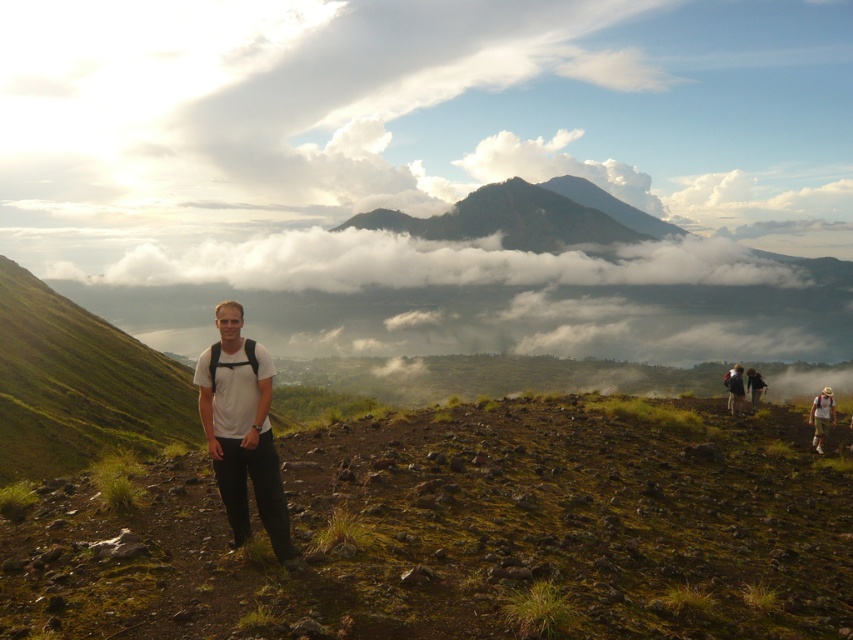
Is white matte t-shirt at center wider than light brown backpack at lower right?

No.

Measure the distance between point (227,337) and camera.

8.39 meters

Identify the location of white matte t-shirt at center. (241, 428).

In the scene shown: Does camouflage fabric backpack at lower right have a lesser height compared to dark brown backpack at right?

No.

Is camouflage fabric backpack at lower right further to the viewer compared to dark brown backpack at right?

No, it is in front of dark brown backpack at right.

Does point (814, 406) come closer to viewer compared to point (763, 387)?

Yes, point (814, 406) is closer to viewer.

Image resolution: width=853 pixels, height=640 pixels. Identify the location of camouflage fabric backpack at lower right. (821, 417).

Find the location of a particular element. The width and height of the screenshot is (853, 640). dark gray rocky mountain at center is located at coordinates (527, 216).

Identify the location of dark gray rocky mountain at center. (527, 216).